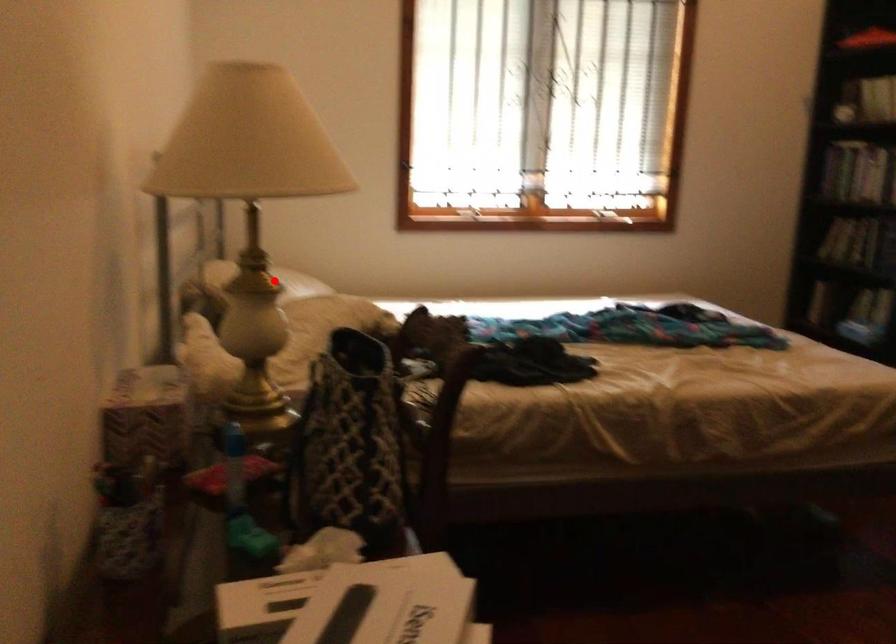
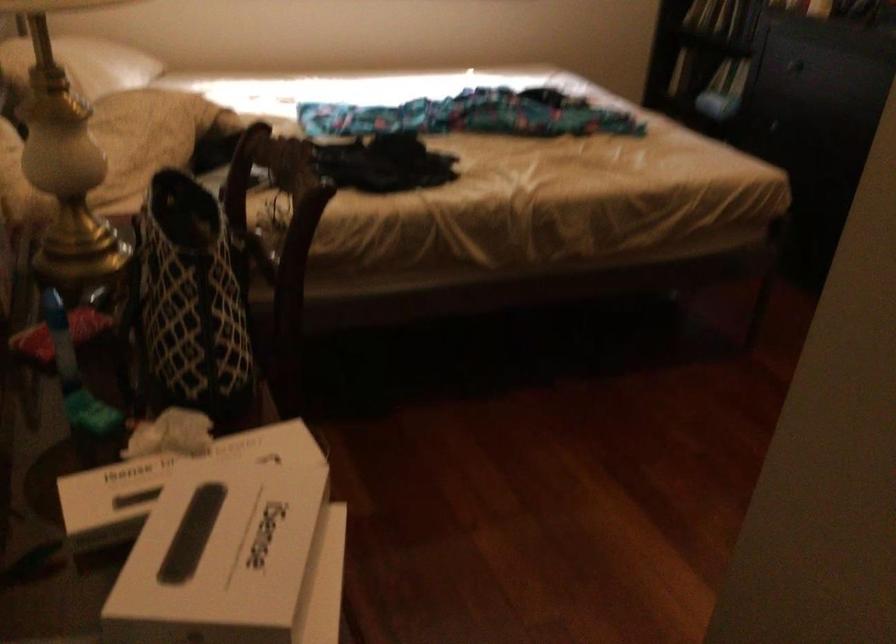
In the second image, find the point that corresponds to the highlighted location in the first image.

(82, 64)